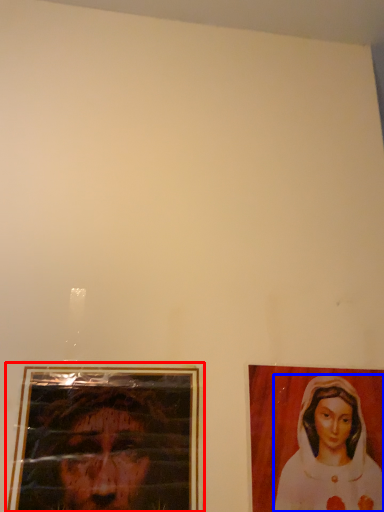
Question: Which object appears farthest to the camera in this image, picture frame (highlighted by a red box) or woman (highlighted by a blue box)?

Choices:
 (A) picture frame
 (B) woman

Answer: (B)